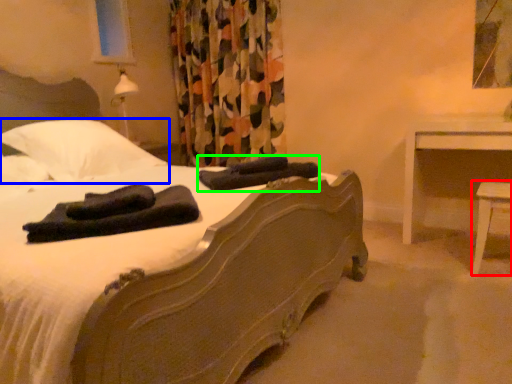
Question: Which object is the farthest from table (highlighted by a red box)? Choose among these: pillow (highlighted by a blue box) or material (highlighted by a green box).

Choices:
 (A) pillow
 (B) material

Answer: (A)